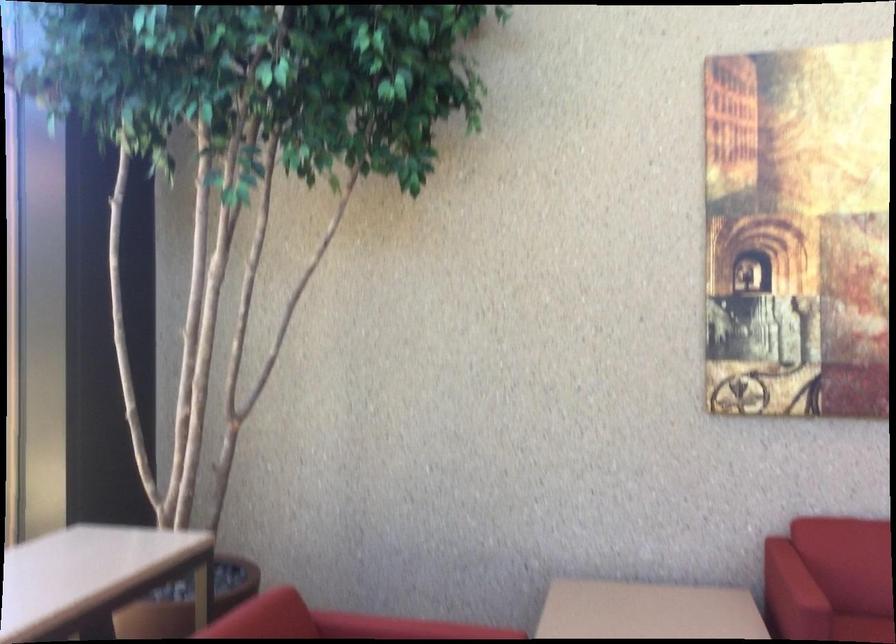
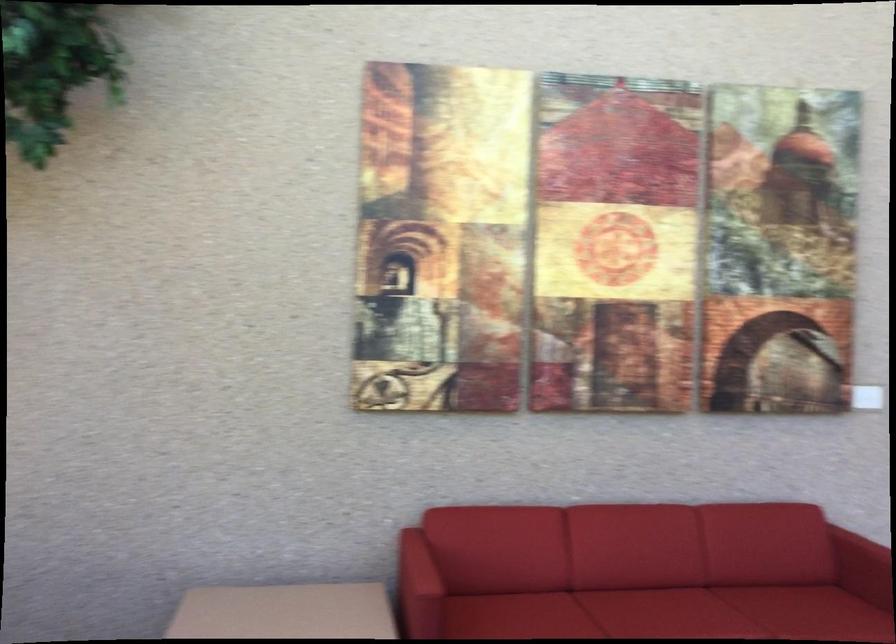
Question: The camera is either moving clockwise (left) or counter-clockwise (right) around the object. The first image is from the beginning of the video and the second image is from the end. Is the camera moving left or right when shooting the video?

Choices:
 (A) Left
 (B) Right

Answer: (A)